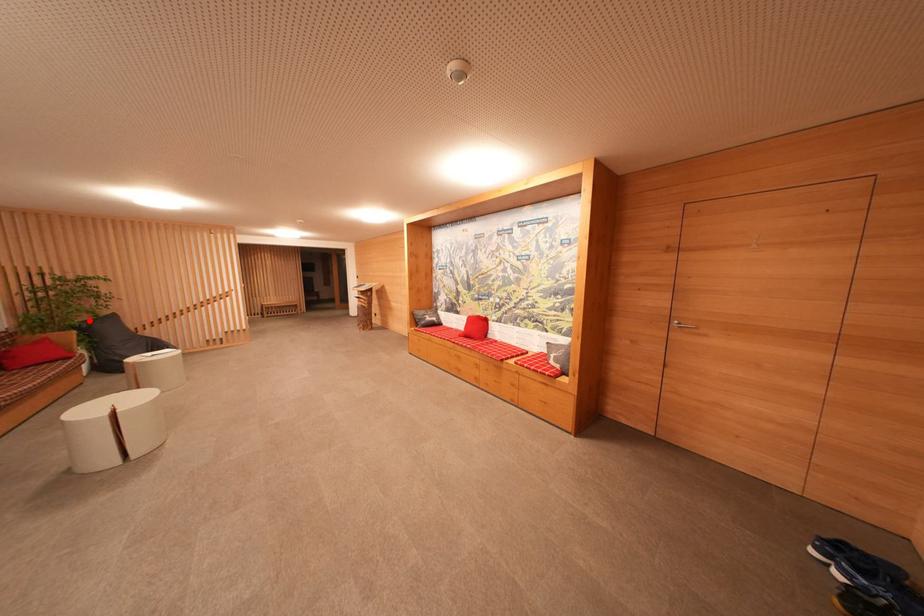
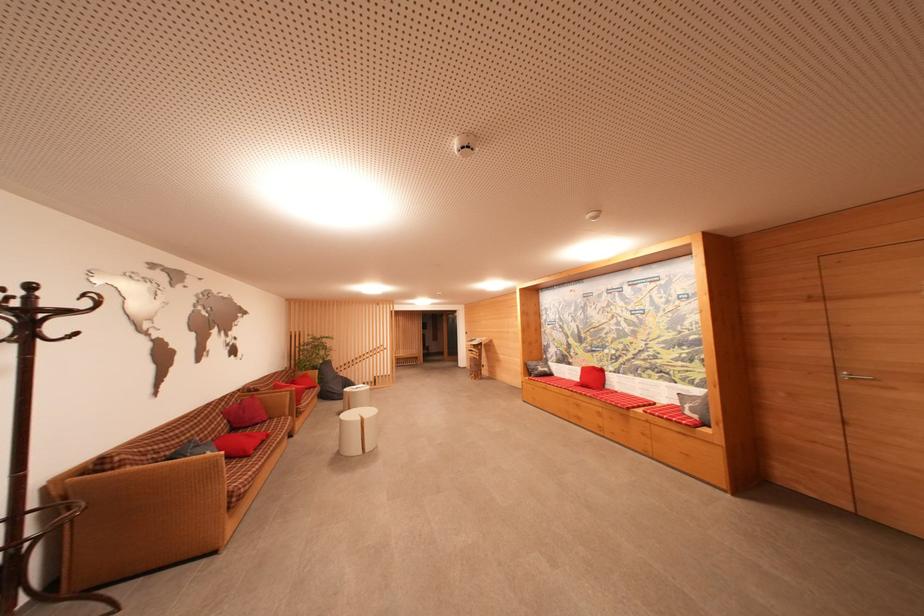
In the second image, find the point that corresponds to the highlighted location in the first image.

(323, 365)